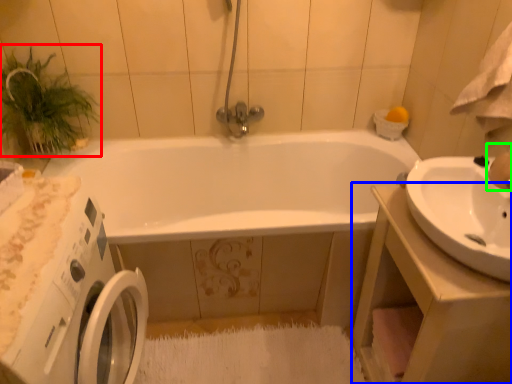
Question: Based on their relative distances, which object is farther from plant (highlighted by a red box)? Choose from counter top (highlighted by a blue box) and faucet (highlighted by a green box).

Choices:
 (A) counter top
 (B) faucet

Answer: (B)